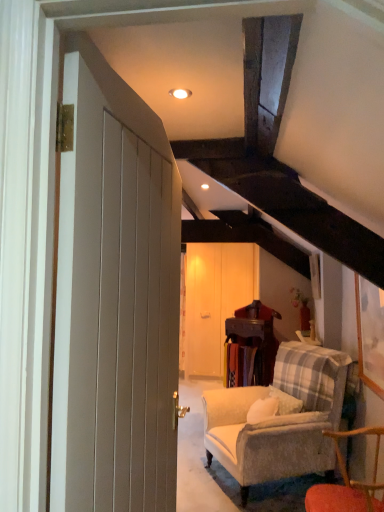
Question: Is the position of wooden table at center more distant than that of wooden chair at lower right?

Choices:
 (A) yes
 (B) no

Answer: (A)

Question: From the image's perspective, would you say wooden table at center is shown under wooden chair at lower right?

Choices:
 (A) no
 (B) yes

Answer: (A)

Question: Would you say wooden table at center is a long distance from wooden chair at lower right?

Choices:
 (A) yes
 (B) no

Answer: (A)

Question: Considering the relative positions of wooden table at center and wooden chair at lower right in the image provided, is wooden table at center to the right of wooden chair at lower right from the viewer's perspective?

Choices:
 (A) yes
 (B) no

Answer: (B)

Question: Can you confirm if wooden table at center is shorter than wooden chair at lower right?

Choices:
 (A) no
 (B) yes

Answer: (A)

Question: Can you confirm if wooden table at center is wider than wooden chair at lower right?

Choices:
 (A) yes
 (B) no

Answer: (B)

Question: From a real-world perspective, is wooden chair at lower right located beneath wooden table at center?

Choices:
 (A) no
 (B) yes

Answer: (B)

Question: Is wooden chair at lower right thinner than wooden table at center?

Choices:
 (A) no
 (B) yes

Answer: (A)

Question: Considering the relative sizes of wooden chair at lower right and wooden table at center in the image provided, is wooden chair at lower right taller than wooden table at center?

Choices:
 (A) yes
 (B) no

Answer: (B)

Question: Does wooden chair at lower right come behind wooden table at center?

Choices:
 (A) no
 (B) yes

Answer: (A)

Question: Does wooden chair at lower right have a smaller size compared to wooden table at center?

Choices:
 (A) yes
 (B) no

Answer: (B)

Question: Is wooden chair at lower right aimed at wooden table at center?

Choices:
 (A) yes
 (B) no

Answer: (B)

Question: Does wooden barn door at center lie in front of matte white door at left?

Choices:
 (A) yes
 (B) no

Answer: (B)